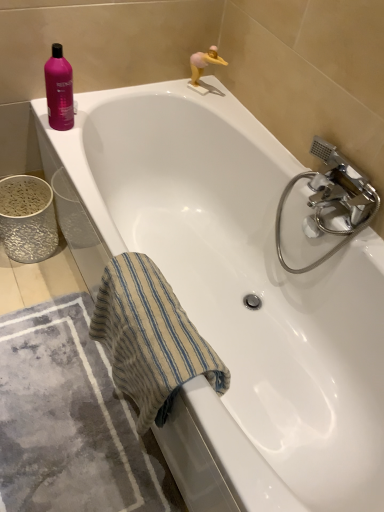
Question: Is chrome metallic faucet at right further to camera compared to pink glossy shampoo at upper left?

Choices:
 (A) yes
 (B) no

Answer: (B)

Question: Is chrome metallic faucet at right not near pink glossy shampoo at upper left?

Choices:
 (A) yes
 (B) no

Answer: (B)

Question: Considering the relative positions of chrome metallic faucet at right and pink glossy shampoo at upper left in the image provided, is chrome metallic faucet at right to the right of pink glossy shampoo at upper left from the viewer's perspective?

Choices:
 (A) yes
 (B) no

Answer: (A)

Question: Is chrome metallic faucet at right outside of pink glossy shampoo at upper left?

Choices:
 (A) yes
 (B) no

Answer: (A)

Question: Does chrome metallic faucet at right have a smaller size compared to pink glossy shampoo at upper left?

Choices:
 (A) no
 (B) yes

Answer: (A)

Question: From a real-world perspective, is chrome metallic faucet at right physically above pink glossy shampoo at upper left?

Choices:
 (A) yes
 (B) no

Answer: (B)

Question: Considering the relative sizes of gray textured bath mat at lower left and pink matte figurine at upper right in the image provided, is gray textured bath mat at lower left taller than pink matte figurine at upper right?

Choices:
 (A) yes
 (B) no

Answer: (B)

Question: Is the position of gray textured bath mat at lower left less distant than that of pink matte figurine at upper right?

Choices:
 (A) no
 (B) yes

Answer: (B)

Question: From the image's perspective, is gray textured bath mat at lower left under pink matte figurine at upper right?

Choices:
 (A) yes
 (B) no

Answer: (A)

Question: From a real-world perspective, is gray textured bath mat at lower left under pink matte figurine at upper right?

Choices:
 (A) no
 (B) yes

Answer: (B)

Question: Can you confirm if gray textured bath mat at lower left is positioned to the right of pink matte figurine at upper right?

Choices:
 (A) no
 (B) yes

Answer: (A)

Question: Can you confirm if gray textured bath mat at lower left is smaller than pink matte figurine at upper right?

Choices:
 (A) no
 (B) yes

Answer: (A)

Question: Is pink matte figurine at upper right closer to camera compared to beige striped towel at lower left?

Choices:
 (A) no
 (B) yes

Answer: (A)